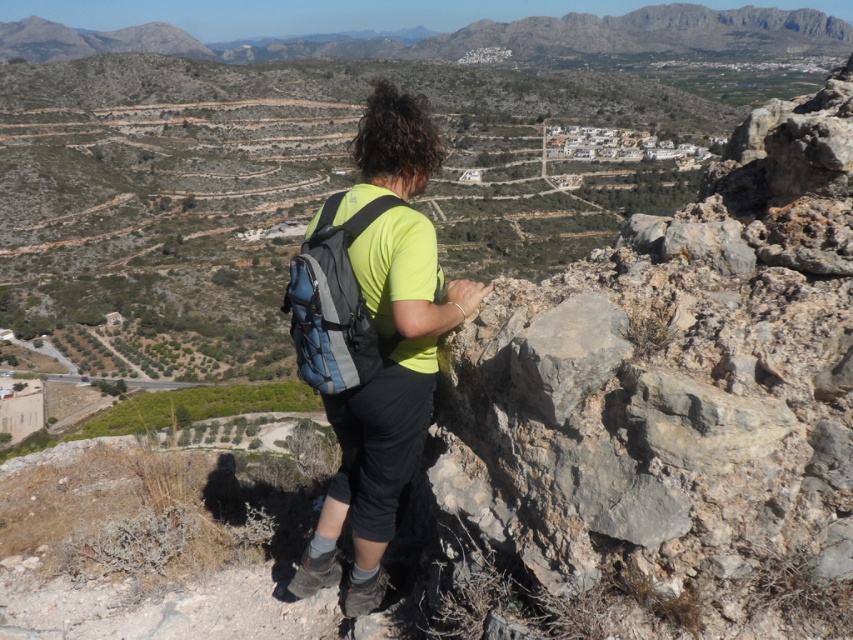
Question: Does gray rough rock at center-right appear under green matte shirt at center?

Choices:
 (A) yes
 (B) no

Answer: (A)

Question: Does green matte shirt at center have a smaller size compared to matte blue backpack at center?

Choices:
 (A) yes
 (B) no

Answer: (B)

Question: Which object is positioned farthest from the gray rough rock at center-right?

Choices:
 (A) green matte shirt at center
 (B) matte blue backpack at center

Answer: (B)

Question: Based on their relative distances, which object is nearer to the green matte shirt at center?

Choices:
 (A) gray rough rock at center-right
 (B) matte blue backpack at center

Answer: (B)

Question: Does gray rough rock at center-right have a smaller size compared to matte blue backpack at center?

Choices:
 (A) yes
 (B) no

Answer: (B)

Question: Which point is closer to the camera?

Choices:
 (A) (296, 355)
 (B) (831, 264)

Answer: (B)